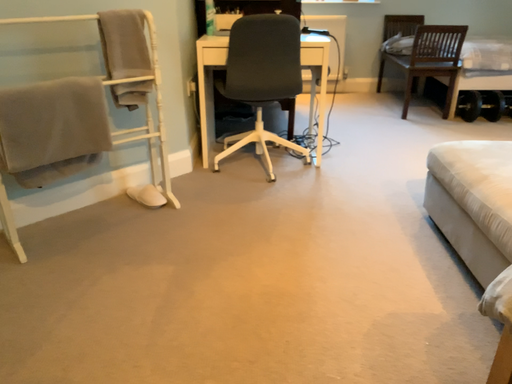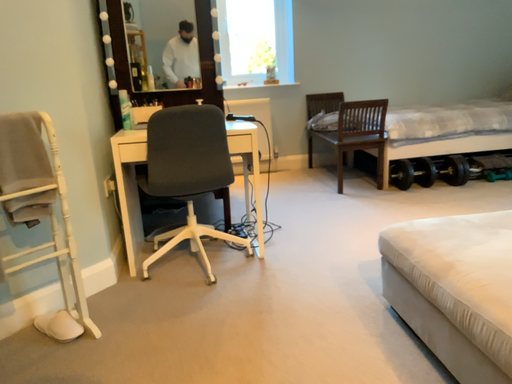
Question: Which way did the camera rotate in the video?

Choices:
 (A) rotated left
 (B) rotated right

Answer: (B)